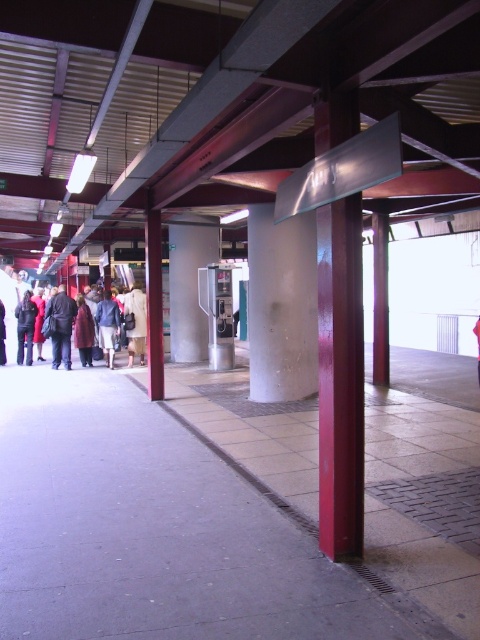
Question: Among these objects, which one is farthest from the camera?

Choices:
 (A) white concrete pillar at center
 (B) dark blue denim jacket at center
 (C) dark blue jeans at center

Answer: (B)

Question: Estimate the real-world distances between objects in this image. Which object is closer to the satin silver pillar at center?

Choices:
 (A) glossy red pillar at center
 (B) white concrete pillar at center
 (C) light beige coat at center

Answer: (C)

Question: Does white concrete pillar at center have a greater width compared to metallic gray pole at center?

Choices:
 (A) yes
 (B) no

Answer: (A)

Question: Is white concrete pillar at center thinner than metallic gray pole at center?

Choices:
 (A) no
 (B) yes

Answer: (A)

Question: Does gray concrete pavement at center have a larger size compared to metallic gray pole at center?

Choices:
 (A) yes
 (B) no

Answer: (B)

Question: Estimate the real-world distances between objects in this image. Which object is farther from the white concrete pillar at center?

Choices:
 (A) satin silver pillar at center
 (B) glossy red pillar at center
 (C) dark blue denim jacket at center
 (D) gray concrete pavement at center

Answer: (B)